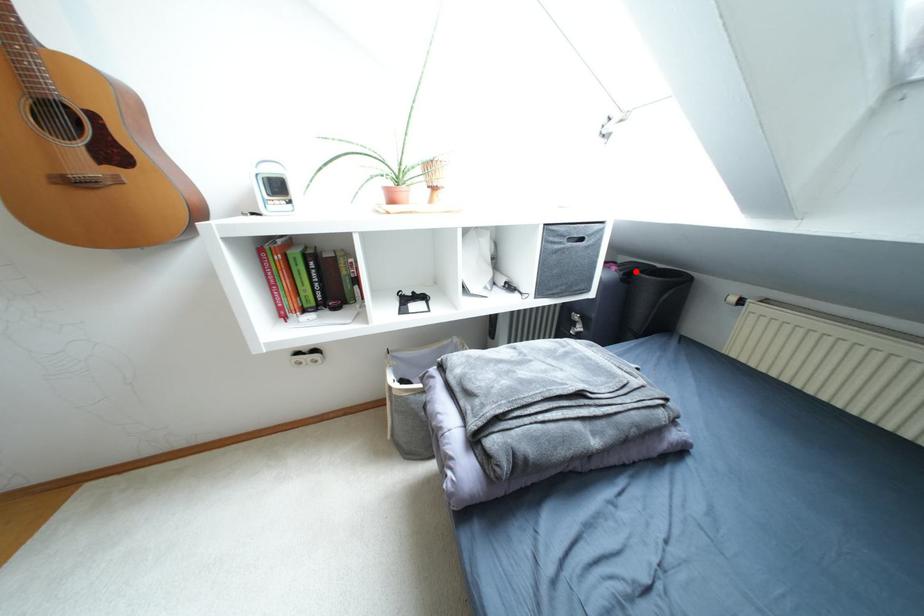
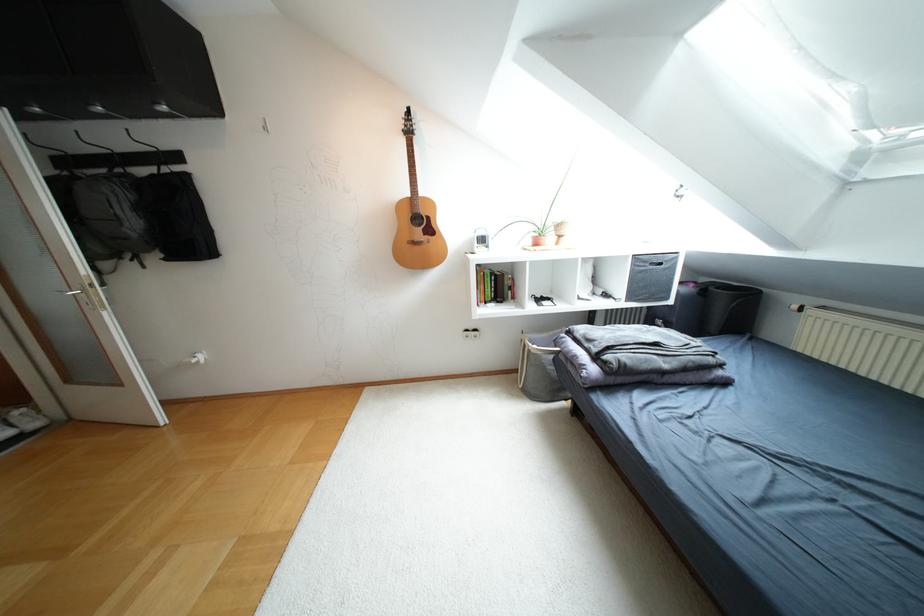
Locate, in the second image, the point that corresponds to the highlighted location in the first image.

(711, 286)